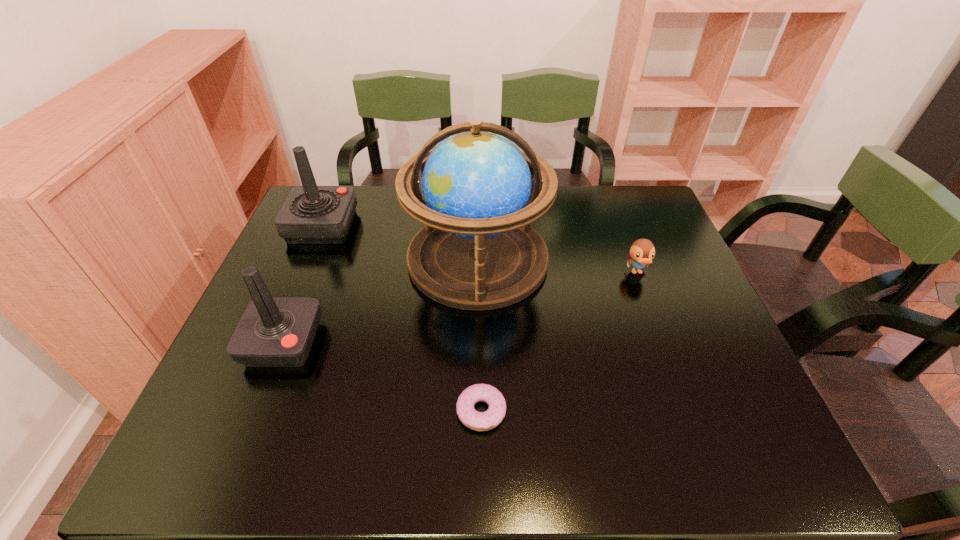
I want to click on vacant space at the right edge of the desktop, so click(675, 244).

You are a GUI agent. You are given a task and a screenshot of the screen. Output one action in this format:
    pyautogui.click(x=<x>, y=<y>)
    Task: Click on the vacant point located between the shortest object and the duck
    This screenshot has height=540, width=960.
    Given the screenshot: What is the action you would take?
    pyautogui.click(x=559, y=341)

I want to click on free space between the farther joystick and the nearer joystick, so click(303, 285).

I want to click on free space between the farther joystick and the tallest object, so click(x=400, y=242).

Identify the location of free space that is in between the nearest object and the globe. This screenshot has height=540, width=960. (479, 335).

Where is `vacant space that is in between the globe and the doughnut`? vacant space that is in between the globe and the doughnut is located at coordinates 479,335.

Identify the location of vacant space that's between the nearest object and the second shortest object. The width and height of the screenshot is (960, 540). (559, 341).

Find the location of a particular element. The width and height of the screenshot is (960, 540). free space between the nearer joystick and the nearest object is located at coordinates (382, 377).

Locate an element on the screen. The width and height of the screenshot is (960, 540). free space between the nearest object and the fourth farthest object is located at coordinates (382, 377).

The image size is (960, 540). I want to click on vacant region between the nearest object and the fourth tallest object, so click(x=559, y=341).